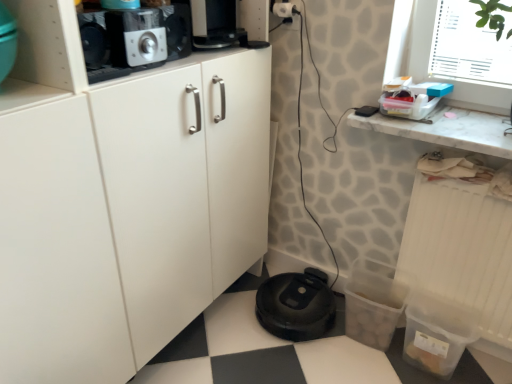
This screenshot has height=384, width=512. I want to click on vacant space behind white plastic window screen at upper right, so click(473, 110).